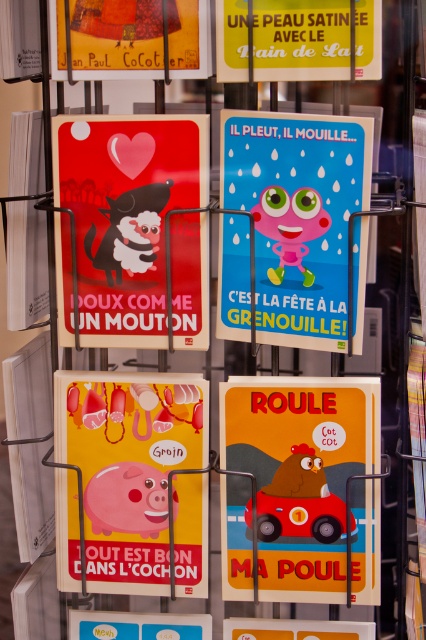
Question: Is matte red poster at upper left above blue glossy poster at center?

Choices:
 (A) yes
 (B) no

Answer: (A)

Question: Which object appears closest to the camera in this image?

Choices:
 (A) matte plastic car at center
 (B) matte red poster at upper left

Answer: (B)

Question: Which object appears farthest from the camera in this image?

Choices:
 (A) matte yellow poster at center
 (B) matte yellow poster at upper left
 (C) blue glossy poster at center

Answer: (A)

Question: Is matte red poster at upper left above matte plastic car at center?

Choices:
 (A) no
 (B) yes

Answer: (B)

Question: Is matte yellow poster at center bigger than yellow satin skin at upper center?

Choices:
 (A) no
 (B) yes

Answer: (B)

Question: Which point is closer to the camera taking this photo?

Choices:
 (A) (111, 64)
 (B) (104, 381)
 (C) (262, 60)

Answer: (C)